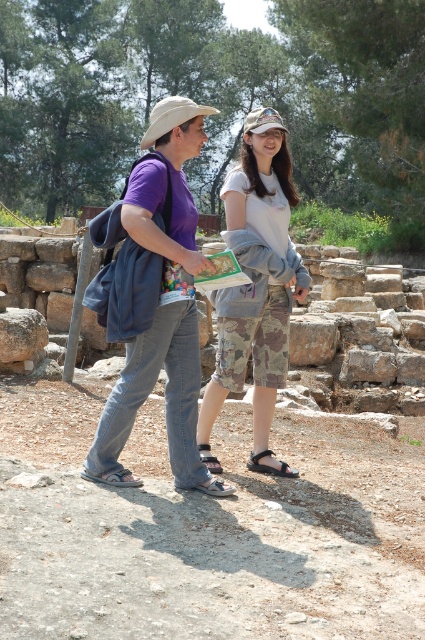
Question: Which object appears closest to the camera in this image?

Choices:
 (A) camo shorts at center
 (B) purple cotton shirt at center
 (C) camo fabric shorts at center

Answer: (B)

Question: Among these points, which one is nearest to the camera?

Choices:
 (A) (221, 340)
 (B) (175, 358)

Answer: (B)

Question: Which point appears closest to the camera in this image?

Choices:
 (A) (254, 284)
 (B) (93, 301)
 (C) (268, 374)

Answer: (B)

Question: Does purple cotton shirt at center have a larger size compared to camo fabric shorts at center?

Choices:
 (A) yes
 (B) no

Answer: (A)

Question: Can you confirm if purple cotton shirt at center is wider than camo fabric shorts at center?

Choices:
 (A) no
 (B) yes

Answer: (B)

Question: Is camo shorts at center below camo fabric shorts at center?

Choices:
 (A) yes
 (B) no

Answer: (B)